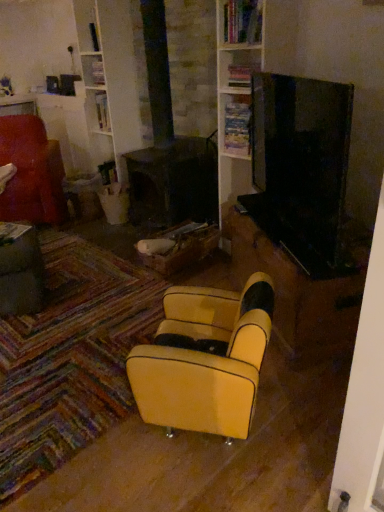
Question: Is wooden bookshelf at upper center, which is the first shelf from top to bottom, bigger or smaller than yellow leather chair at center, which is the 2th chair in top-to-bottom order?

Choices:
 (A) small
 (B) big

Answer: (A)

Question: Would you say wooden bookshelf at upper center, which is the first shelf from top to bottom, is inside or outside yellow leather chair at center, which is counted as the first chair, starting from the right?

Choices:
 (A) inside
 (B) outside

Answer: (B)

Question: Estimate the real-world distances between objects in this image. Which object is closer to the wooden bookshelf at upper center, positioned as the second shelf in top-to-bottom order?

Choices:
 (A) yellow leather chair at center, which appears as the 2th chair when viewed from the back
 (B) velvet red armchair at left, which is the second chair in right-to-left order
 (C) metallic gray table at lower left
 (D) wooden bookshelf at upper center, which is the 2th shelf in bottom-to-top order

Answer: (D)

Question: Which is nearer to the wooden bookshelf at upper center, which is the first shelf from top to bottom?

Choices:
 (A) metallic gray table at lower left
 (B) velvet red armchair at left, which ranks as the 1th chair in back-to-front order
 (C) wooden bookshelf at upper center, which appears as the 1th shelf when ordered from the bottom
 (D) yellow leather chair at center, the 1th chair ordered from the bottom

Answer: (C)